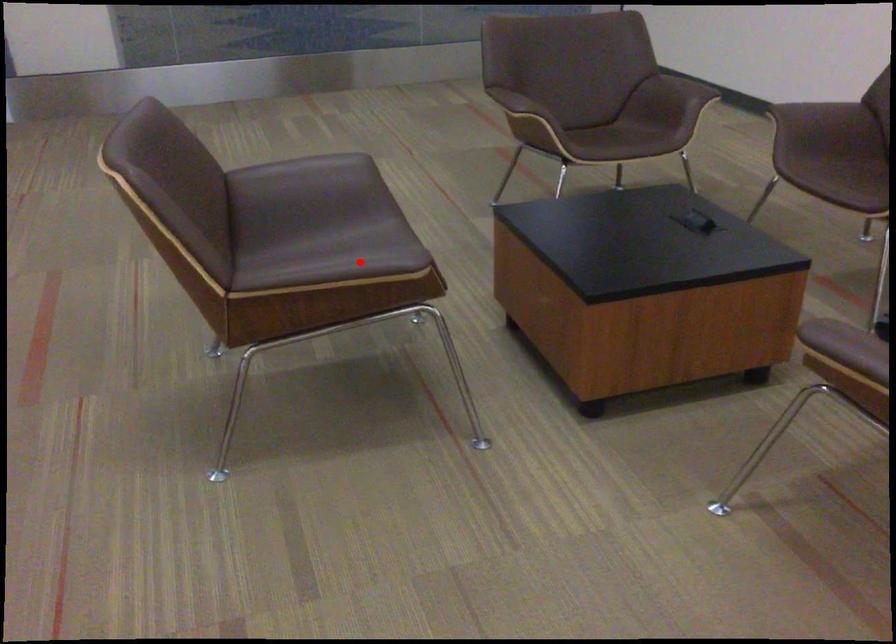
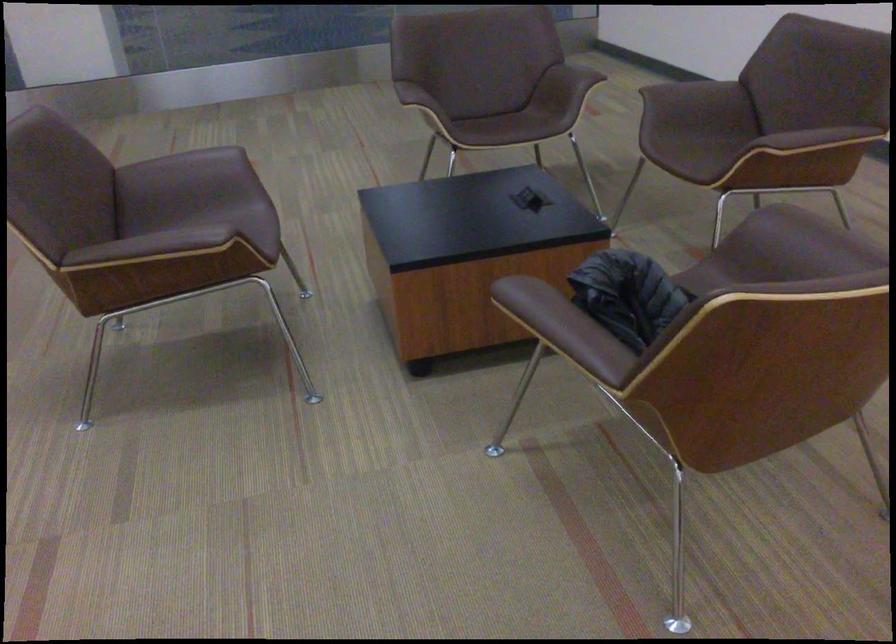
Question: I am providing you with two images of the same scene from different viewpoints. Given a red point in image1, look at the same physical point in image2. Is it:

Choices:
 (A) Closer to the viewpoint
 (B) Farther from the viewpoint

Answer: (B)